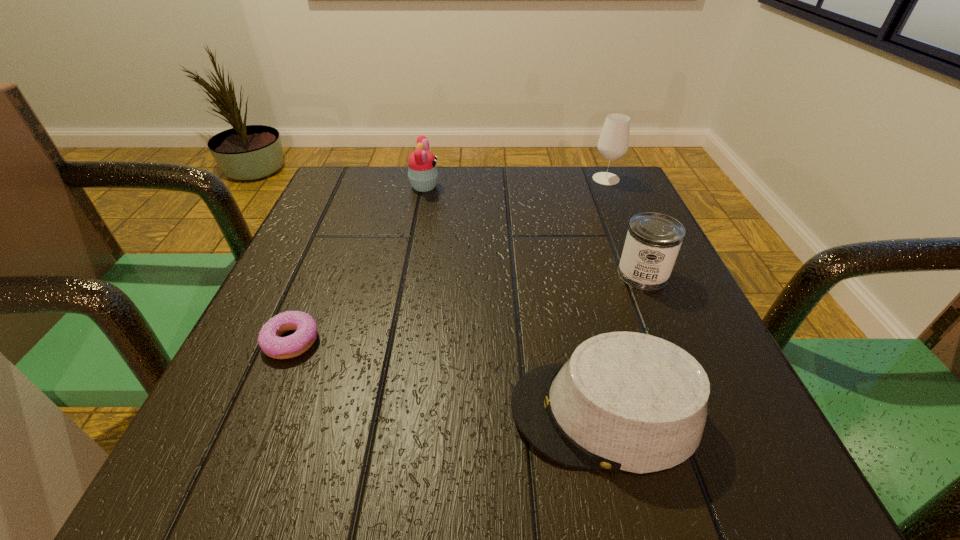
Find the location of a particular element. the tallest object is located at coordinates (613, 142).

The image size is (960, 540). Find the location of `the second object from left to right`. the second object from left to right is located at coordinates (422, 169).

The width and height of the screenshot is (960, 540). What are the coordinates of `the third nearest object` in the screenshot? It's located at (653, 240).

Find the location of a particular element. The height and width of the screenshot is (540, 960). hat is located at coordinates (625, 401).

At what (x,y) coordinates should I click in order to perform the action: click on the leftmost object. Please return your answer as a coordinate pair (x, y). Looking at the image, I should click on (270, 341).

At what (x,y) coordinates should I click in order to perform the action: click on doughnut. Please return your answer as a coordinate pair (x, y). Image resolution: width=960 pixels, height=540 pixels. Looking at the image, I should click on (270, 341).

Locate an element on the screen. This screenshot has width=960, height=540. vacant space situated on the front of the glass is located at coordinates (623, 219).

In order to click on vacant space located on the face of the cupcake in this screenshot , I will do click(506, 186).

Where is `blank area located 0.090m on the back of the can`? The height and width of the screenshot is (540, 960). blank area located 0.090m on the back of the can is located at coordinates (625, 232).

This screenshot has height=540, width=960. I want to click on vacant space located on the front-facing side of the hat, so click(x=228, y=413).